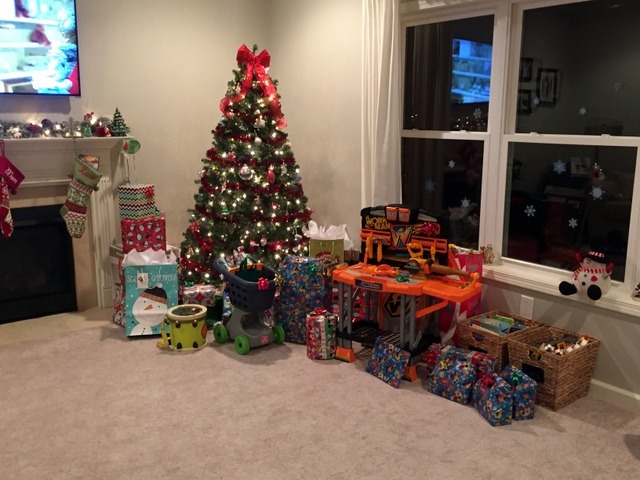
In order to click on christmas tree in this screenshot , I will do `click(259, 166)`.